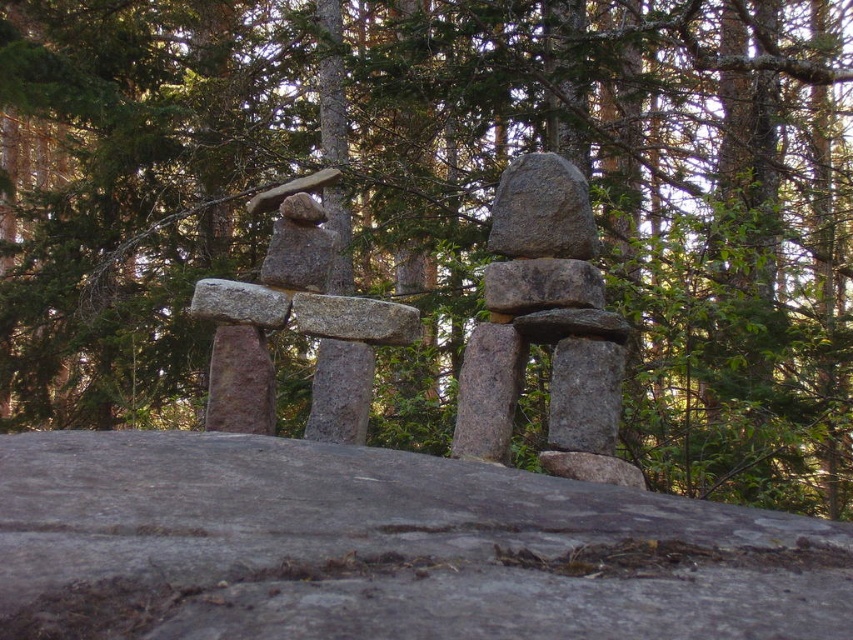
Between smooth gray stone sculpture at center and gray granite rock at center, which one has more height?

Standing taller between the two is smooth gray stone sculpture at center.

Is smooth gray stone sculpture at center bigger than gray granite rock at center?

Yes.

Where is `smooth gray stone sculpture at center`? smooth gray stone sculpture at center is located at coordinates (294, 324).

This screenshot has height=640, width=853. Identify the location of smooth gray stone sculpture at center. (294, 324).

Is smooth gray stone sculpture at center shorter than gray rough stone at center?

Incorrect, smooth gray stone sculpture at center's height does not fall short of gray rough stone at center's.

Between smooth gray stone sculpture at center and gray rough stone at center, which one has more height?

Standing taller between the two is smooth gray stone sculpture at center.

Locate an element on the screen. This screenshot has height=640, width=853. smooth gray stone sculpture at center is located at coordinates (294, 324).

Does point (537, 221) come closer to viewer compared to point (566, 292)?

No.

Can you confirm if gray granite rock at center is taller than gray rough stone at center?

Indeed, gray granite rock at center has a greater height compared to gray rough stone at center.

Find the location of a particular element. The width and height of the screenshot is (853, 640). gray granite rock at center is located at coordinates (543, 211).

Where is `gray granite rock at center`? The image size is (853, 640). gray granite rock at center is located at coordinates (543, 211).